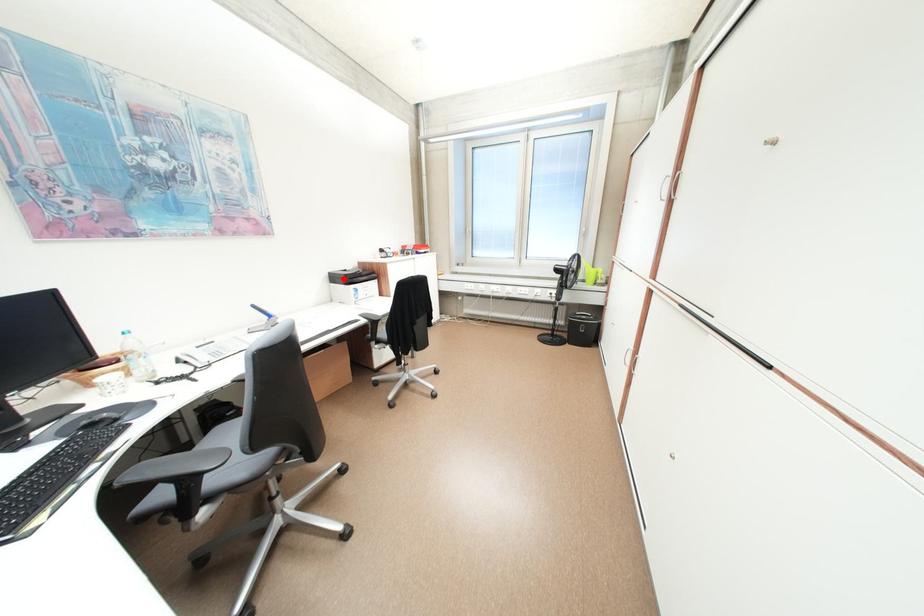
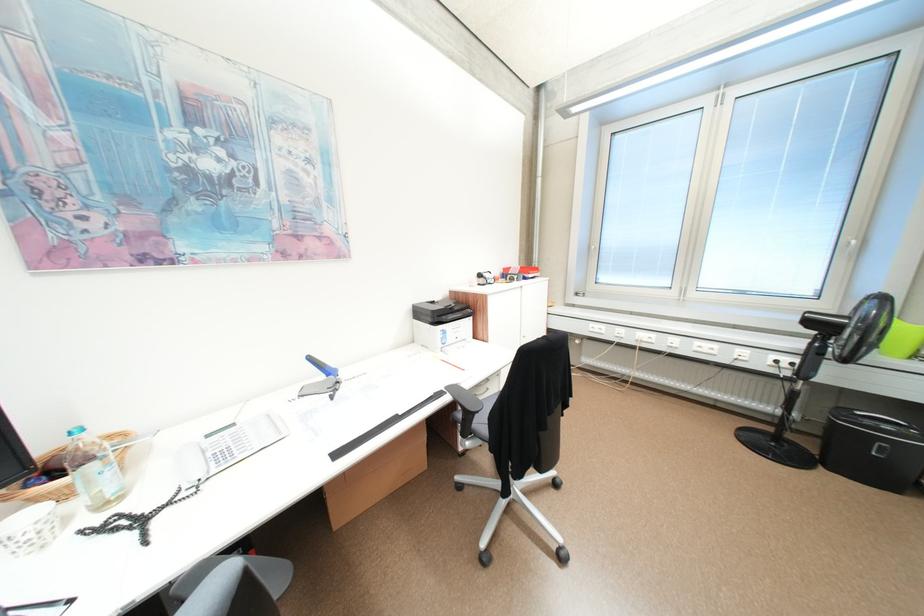
The point at the highlighted location is marked in the first image. Where is the corresponding point in the second image?

(428, 313)